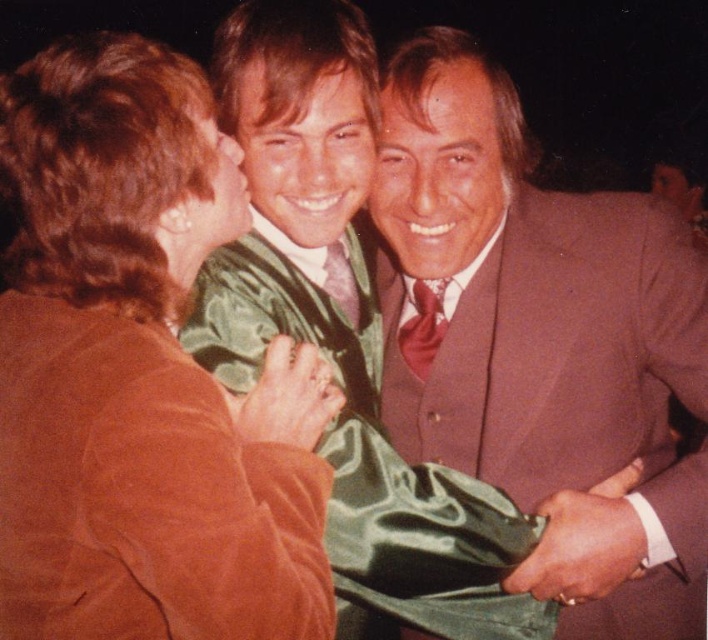
I want to click on brown suede jacket at upper left, so click(137, 376).

Does point (193, 147) lie behind point (486, 225)?

No, (193, 147) is in front of (486, 225).

This screenshot has width=708, height=640. What are the coordinates of `brown suede jacket at upper left` in the screenshot? It's located at (137, 376).

Is brown suede jacket at upper left positioned at the back of satin green dress at center?

That is False.

Is point (96, 394) positioned before point (486, 509)?

Yes, it is in front of point (486, 509).

Find the location of `brown suede jacket at upper left`. brown suede jacket at upper left is located at coordinates (137, 376).

The width and height of the screenshot is (708, 640). What are the coordinates of `brown suede jacket at upper left` in the screenshot? It's located at (137, 376).

Who is more distant from viewer, [491,573] or [325,268]?

Point [325,268]

The image size is (708, 640). I want to click on satin green dress at center, so click(370, 456).